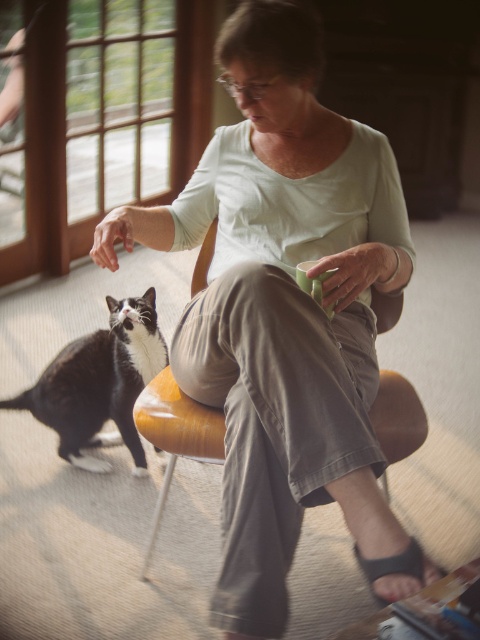
Question: Which of the following is the farthest from the observer?

Choices:
 (A) (86, 380)
 (B) (165, 371)
 (C) (411, 257)

Answer: (A)

Question: Can you confirm if matte green shirt at center is thinner than wooden chair at center?

Choices:
 (A) yes
 (B) no

Answer: (B)

Question: Which object appears closest to the camera in this image?

Choices:
 (A) wooden chair at center
 (B) matte green shirt at center
 (C) black and white fur cat at lower left

Answer: (B)

Question: Can you confirm if matte green shirt at center is positioned to the right of black and white fur cat at lower left?

Choices:
 (A) no
 (B) yes

Answer: (B)

Question: Where is black and white fur cat at lower left located in relation to wooden chair at center in the image?

Choices:
 (A) right
 (B) left

Answer: (B)

Question: Which object is the farthest from the wooden chair at center?

Choices:
 (A) matte green shirt at center
 (B) black and white fur cat at lower left

Answer: (A)